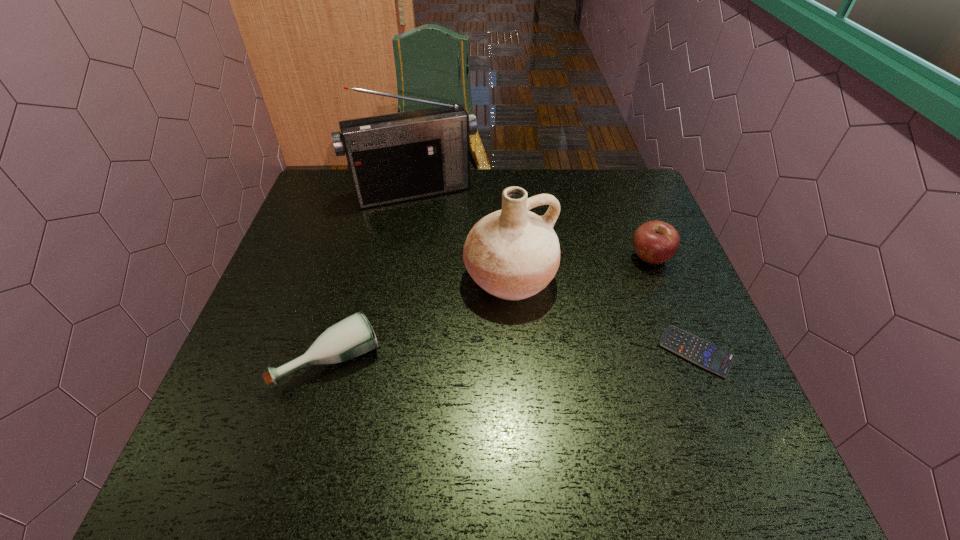
The height and width of the screenshot is (540, 960). I want to click on free space located on the front-facing side of the radio receiver, so click(461, 282).

The width and height of the screenshot is (960, 540). I want to click on free location located 0.150m to pour from the handle of the second tallest object, so click(x=564, y=361).

This screenshot has width=960, height=540. Find the location of `free space located 0.160m to pour from the handle of the second tallest object`. free space located 0.160m to pour from the handle of the second tallest object is located at coordinates (566, 365).

Where is `vacant area situated 0.160m to pour from the handle of the second tallest object`? vacant area situated 0.160m to pour from the handle of the second tallest object is located at coordinates (566, 365).

Where is `free space located on the side of the apple with the unique marking`? free space located on the side of the apple with the unique marking is located at coordinates (518, 326).

Image resolution: width=960 pixels, height=540 pixels. I want to click on free region located 0.210m on the side of the apple with the unique marking, so 572,298.

You are a GUI agent. You are given a task and a screenshot of the screen. Output one action in this format:
    pyautogui.click(x=<x>, y=<y>)
    Task: Click on the vacant space located 0.400m on the side of the apple with the unique marking
    The width and height of the screenshot is (960, 540).
    Given the screenshot: What is the action you would take?
    pyautogui.click(x=507, y=332)

This screenshot has height=540, width=960. I want to click on object that is at the far edge, so click(x=396, y=157).

Where is `object situated at the near edge`? object situated at the near edge is located at coordinates (353, 336).

You are a GUI agent. You are given a task and a screenshot of the screen. Output one action in this format:
    pyautogui.click(x=<x>, y=<y>)
    Task: Click on the bottle that is at the left edge
    This screenshot has width=960, height=540.
    Given the screenshot: What is the action you would take?
    pyautogui.click(x=353, y=336)